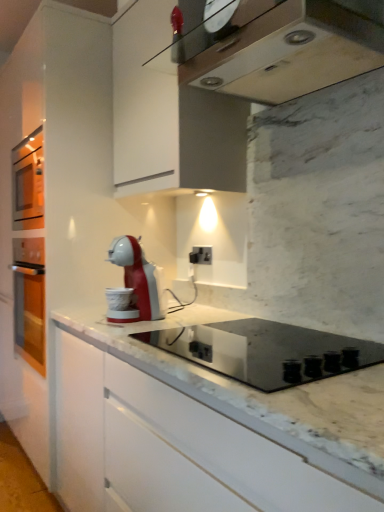
Describe the element at coordinates (201, 255) in the screenshot. The width and height of the screenshot is (384, 512). I see `black plastic electric outlet at center` at that location.

Identify the location of black glass cooktop at center. Image resolution: width=384 pixels, height=512 pixels. (266, 351).

In order to face black glass cooktop at center, should I rotate leftwards or rightwards?

You should rotate right by 9.437 degrees.

What do you see at coordinates (280, 50) in the screenshot? I see `metallic silver range hood at upper center` at bounding box center [280, 50].

Locate an element on the screen. Image resolution: width=384 pixels, height=512 pixels. black plastic electric outlet at center is located at coordinates (201, 255).

Is metallic silver range hood at upper center facing towards black glass cooktop at center?

No, metallic silver range hood at upper center is not aimed at black glass cooktop at center.

Between metallic silver range hood at upper center and black glass cooktop at center, which one has less height?

With less height is metallic silver range hood at upper center.

From the picture: Between metallic silver range hood at upper center and black glass cooktop at center, which one appears on the right side from the viewer's perspective?

Positioned to the right is metallic silver range hood at upper center.

Does metallic silver range hood at upper center have a smaller size compared to black glass cooktop at center?

Indeed, metallic silver range hood at upper center has a smaller size compared to black glass cooktop at center.

Relative to metallic silver range hood at upper center, is black glass cooktop at center in front or behind?

In the image, black glass cooktop at center appears behind metallic silver range hood at upper center.

From a real-world perspective, relative to metallic silver range hood at upper center, is black glass cooktop at center vertically above or below?

black glass cooktop at center is below metallic silver range hood at upper center.

Is black glass cooktop at center next to metallic silver range hood at upper center?

No.

In the scene shown: Does black glass cooktop at center turn towards metallic silver range hood at upper center?

No, black glass cooktop at center does not turn towards metallic silver range hood at upper center.

Considering the sizes of objects black plastic electric outlet at center and metallic silver range hood at upper center in the image provided, who is thinner, black plastic electric outlet at center or metallic silver range hood at upper center?

Thinner between the two is black plastic electric outlet at center.

In the scene shown: Considering the positions of objects black plastic electric outlet at center and metallic silver range hood at upper center in the image provided, who is more to the left, black plastic electric outlet at center or metallic silver range hood at upper center?

From the viewer's perspective, black plastic electric outlet at center appears more on the left side.

At what (x,y) coordinates should I click in order to perform the action: click on home appliance on the right of the black plastic electric outlet at center. Please return your answer as a coordinate pair (x, y). Looking at the image, I should click on (280, 50).

Is black plastic electric outlet at center located within metallic silver range hood at upper center?

No, black plastic electric outlet at center is not a part of metallic silver range hood at upper center.

Which is behind, metallic silver range hood at upper center or black plastic electric outlet at center?

black plastic electric outlet at center.

I want to click on electric outlet located on the left of metallic silver range hood at upper center, so click(201, 255).

Which of these two, black plastic electric outlet at center or black glass cooktop at center, stands shorter?

With less height is black plastic electric outlet at center.

Considering the relative sizes of black plastic electric outlet at center and black glass cooktop at center in the image provided, is black plastic electric outlet at center thinner than black glass cooktop at center?

Correct, the width of black plastic electric outlet at center is less than that of black glass cooktop at center.

Does black plastic electric outlet at center appear on the left side of black glass cooktop at center?

Yes.

Considering the sizes of objects black plastic electric outlet at center and black glass cooktop at center in the image provided, who is bigger, black plastic electric outlet at center or black glass cooktop at center?

black glass cooktop at center is bigger.

Is black glass cooktop at center facing away from black plastic electric outlet at center?

No, black plastic electric outlet at center is not at the back of black glass cooktop at center.

Can you confirm if black glass cooktop at center is thinner than black plastic electric outlet at center?

Incorrect, the width of black glass cooktop at center is not less than that of black plastic electric outlet at center.

Who is taller, black glass cooktop at center or black plastic electric outlet at center?

black glass cooktop at center.

Image resolution: width=384 pixels, height=512 pixels. Identify the location of home appliance in front of the black glass cooktop at center. (280, 50).

Where is `appliance below the metallic silver range hood at upper center (from a real-world perspective)`? This screenshot has height=512, width=384. appliance below the metallic silver range hood at upper center (from a real-world perspective) is located at coordinates (266, 351).

Based on their spatial positions, is black glass cooktop at center or metallic silver range hood at upper center further from black plastic electric outlet at center?

The object further to black plastic electric outlet at center is metallic silver range hood at upper center.

From the image, which object appears to be farther from metallic silver range hood at upper center, black plastic electric outlet at center or black glass cooktop at center?

Among the two, black plastic electric outlet at center is located further to metallic silver range hood at upper center.

When comparing their distances from black plastic electric outlet at center, does metallic silver range hood at upper center or black glass cooktop at center seem further?

Based on the image, metallic silver range hood at upper center appears to be further to black plastic electric outlet at center.

From the image, which object appears to be farther from black glass cooktop at center, metallic silver range hood at upper center or black plastic electric outlet at center?

The object further to black glass cooktop at center is metallic silver range hood at upper center.

Which object lies nearer to the anchor point metallic silver range hood at upper center, black glass cooktop at center or black plastic electric outlet at center?

black glass cooktop at center lies closer to metallic silver range hood at upper center than the other object.

When comparing their distances from black glass cooktop at center, does black plastic electric outlet at center or metallic silver range hood at upper center seem closer?

black plastic electric outlet at center lies closer to black glass cooktop at center than the other object.

You are a GUI agent. You are given a task and a screenshot of the screen. Output one action in this format:
    pyautogui.click(x=<x>, y=<y>)
    Task: Click on the appliance located between metallic silver range hood at upper center and black plastic electric outlet at center in the depth direction
    
    Given the screenshot: What is the action you would take?
    pyautogui.click(x=266, y=351)